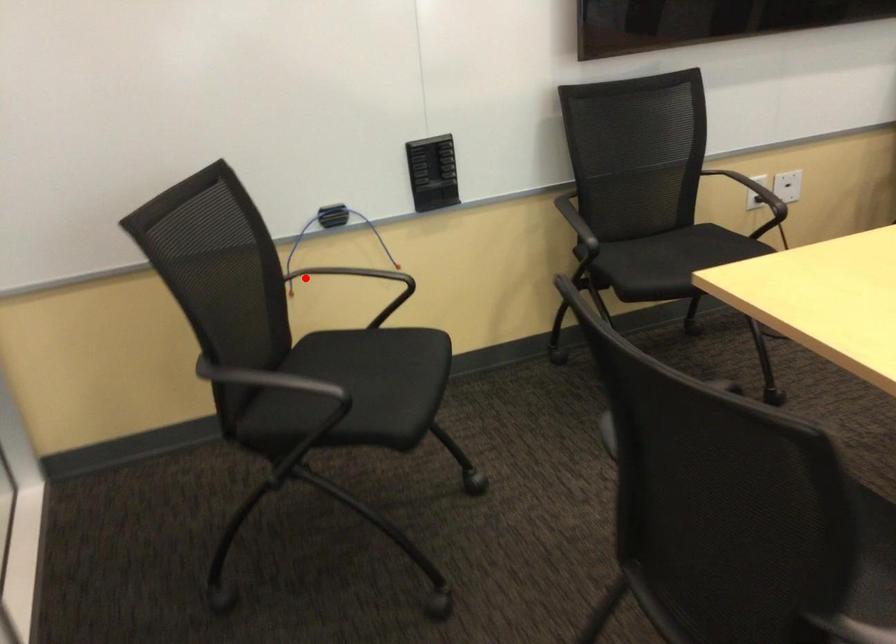
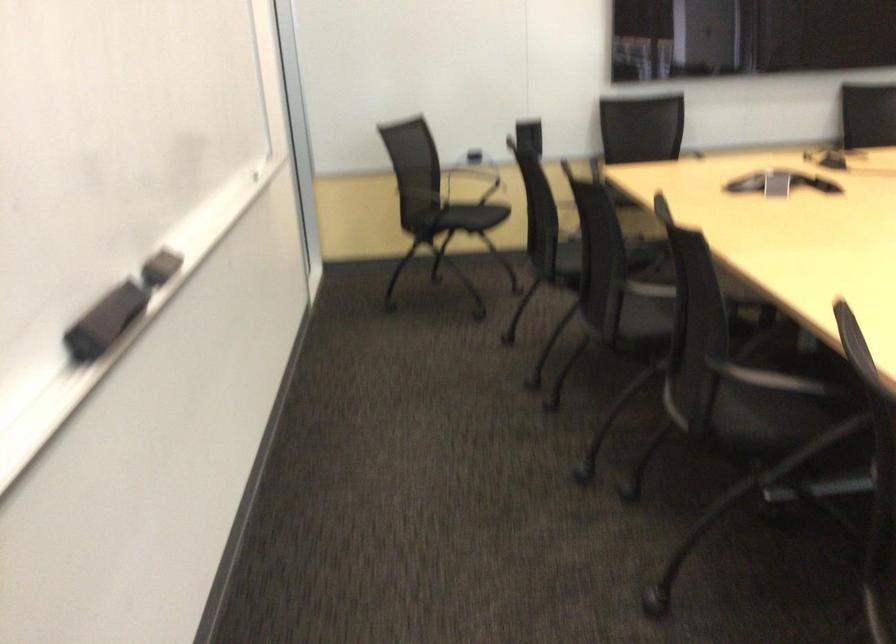
Locate, in the second image, the point that corresponds to the highlighted location in the first image.

(472, 180)